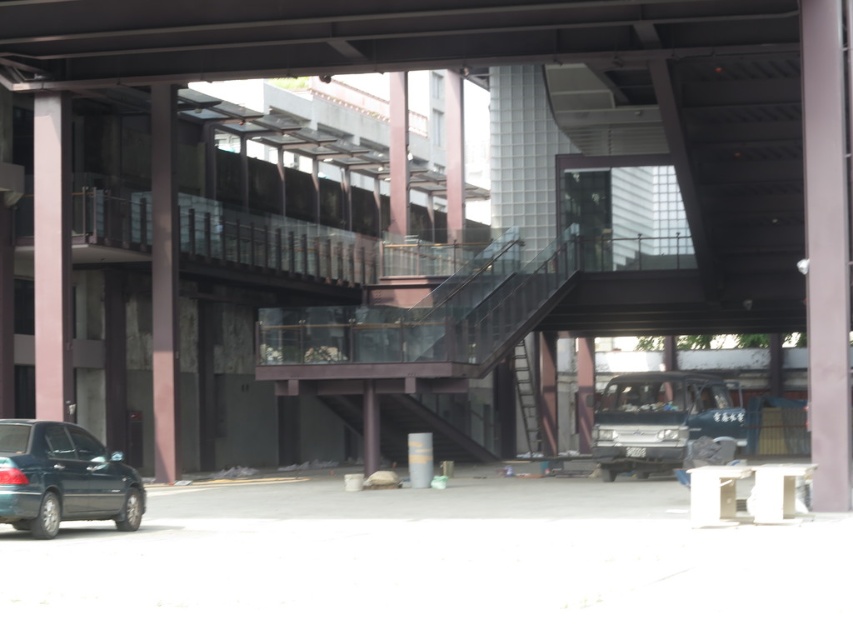
Is shiny dark blue sedan at lower left bigger than pink matte pillar at left?

Yes.

Does point (111, 516) lie in front of point (173, 92)?

That is True.

Who is more forward, (33,534) or (154,262)?

Positioned in front is point (33,534).

You are a GUI agent. You are given a task and a screenshot of the screen. Output one action in this format:
    pyautogui.click(x=<x>, y=<y>)
    Task: Click on the shiny dark blue sedan at lower left
    This screenshot has height=640, width=853.
    Given the screenshot: What is the action you would take?
    pyautogui.click(x=62, y=477)

Which of these two, dark blue matte van at center or pink matte pillar at left, stands taller?

dark blue matte van at center

Between dark blue matte van at center and pink matte pillar at left, which one has less height?

Standing shorter between the two is pink matte pillar at left.

Identify the location of dark blue matte van at center. This screenshot has width=853, height=640. (660, 419).

Where is `shiny dark blue sedan at lower left`? shiny dark blue sedan at lower left is located at coordinates (62, 477).

Is point (76, 484) positioned after point (465, 454)?

No, it is in front of (465, 454).

Locate an element on the screen. The height and width of the screenshot is (640, 853). shiny dark blue sedan at lower left is located at coordinates (62, 477).